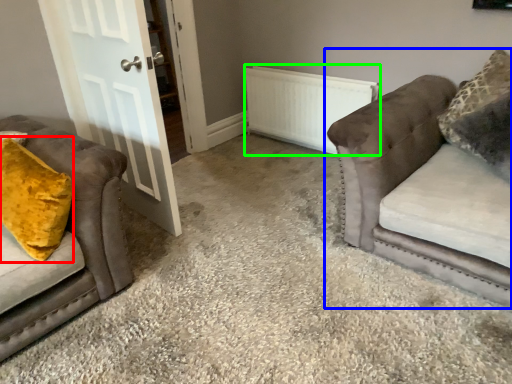
Question: Considering the real-world distances, which object is closest to throw pillow (highlighted by a red box)? studio couch (highlighted by a blue box) or radiator (highlighted by a green box).

Choices:
 (A) studio couch
 (B) radiator

Answer: (A)